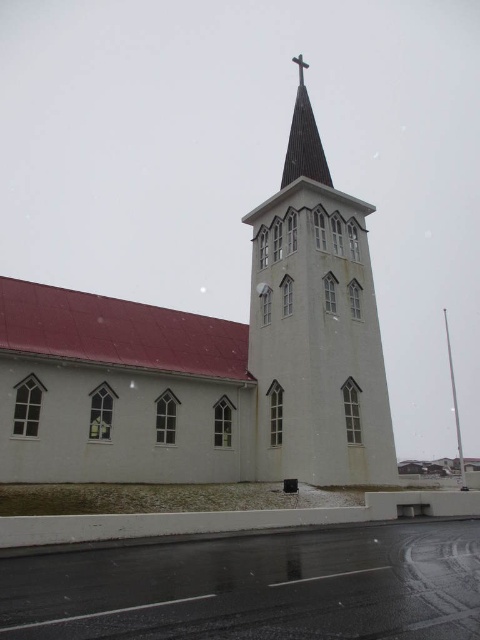
You are standing in front of the church and want to place a new statue in front of the white matte church at center. To ensure it is visible from the road, should the statue be placed above or below the metallic cross at upper center?

The statue should be placed below the metallic cross at upper center because the white matte church at center is already positioned below it, and placing the statue lower would keep it within the church area and visible from the road.

You are an architect designing a new church and want to ensure the steeple proportions match the existing structure. Given the white smooth steeple at center and the dark brown wood steeple at upper center, which steeple should have a wider base to maintain proportionality?

The white smooth steeple at center should have a wider base since its width is larger than the dark brown wood steeple at upper center according to the description.